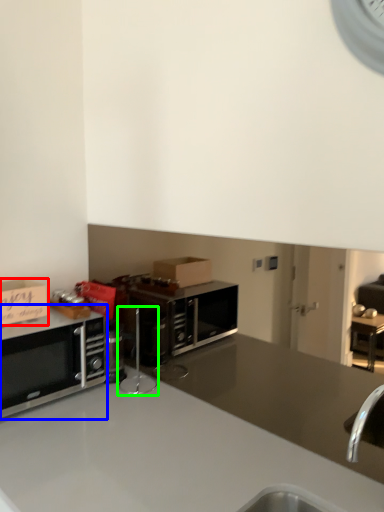
Question: Which is nearer to the cabinetry (highlighted by a red box)? microwave oven (highlighted by a blue box) or appliance (highlighted by a green box).

Choices:
 (A) microwave oven
 (B) appliance

Answer: (A)